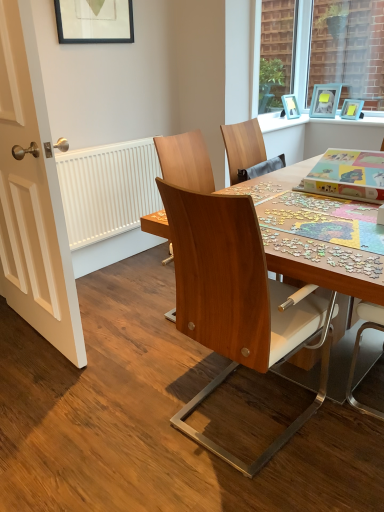
The image size is (384, 512). What are the coordinates of `wooden chair at center, acting as the 2th chair starting from the right` in the screenshot? It's located at (185, 161).

Locate an element on the screen. white painted wood door at left is located at coordinates (32, 195).

Which object is wider, white painted wood door at left or matte black picture frame at upper left, which is the third picture frame from right to left?

Wider between the two is white painted wood door at left.

Would you say white painted wood door at left is a long distance from matte black picture frame at upper left, which is the first picture frame from front to back?

Yes.

From the image's perspective, which is above, white painted wood door at left or matte black picture frame at upper left, positioned as the 1th picture frame in left-to-right order?

matte black picture frame at upper left, positioned as the 1th picture frame in left-to-right order, from the image's perspective.

Does white painted wood door at left have a smaller size compared to matte black picture frame at upper left, which is the first picture frame from front to back?

Incorrect, white painted wood door at left is not smaller in size than matte black picture frame at upper left, which is the first picture frame from front to back.

From the image's perspective, is wooden chair at center, which is the first chair in left-to-right order, above or below white painted wood door at left?

Clearly, from the image's perspective, wooden chair at center, which is the first chair in left-to-right order, is below white painted wood door at left.

Is the position of wooden chair at center, acting as the 2th chair starting from the right, less distant than that of white painted wood door at left?

No, it is behind white painted wood door at left.

Is white painted wood door at left completely or partially inside wooden chair at center, acting as the 2th chair starting from the right?

No.

Could you tell me if light blue plastic picture frame at upper right, the 1th picture frame viewed from the back, is facing wooden chair at center, which is the first chair in left-to-right order?

Yes, light blue plastic picture frame at upper right, the 1th picture frame viewed from the back, is aimed at wooden chair at center, which is the first chair in left-to-right order.

Between point (315, 89) and point (202, 175), which one is positioned in front?

The point (202, 175) is closer to the camera.

Does light blue plastic picture frame at upper right, marked as the 2th picture frame in a right-to-left arrangement, appear on the right side of wooden chair at center, which is the first chair in left-to-right order?

Yes.

Can you see light blue plastic picture frame at upper right, acting as the 2th picture frame starting from the left, touching wooden chair at center, acting as the 2th chair starting from the right?

No, light blue plastic picture frame at upper right, acting as the 2th picture frame starting from the left, is not next to wooden chair at center, acting as the 2th chair starting from the right.

Which is in front, matte blue picture frame at upper right, the 2th picture frame when ordered from back to front, or wooden chair at center, which is the first chair in left-to-right order?

wooden chair at center, which is the first chair in left-to-right order.

From the image's perspective, who appears lower, matte blue picture frame at upper right, the 2th picture frame when ordered from back to front, or wooden chair at center, acting as the 2th chair starting from the right?

wooden chair at center, acting as the 2th chair starting from the right, appears lower in the image.

Is matte blue picture frame at upper right, which ranks as the second picture frame in front-to-back order, oriented away from wooden chair at center, which is the first chair in left-to-right order?

No, matte blue picture frame at upper right, which ranks as the second picture frame in front-to-back order, is not facing away from wooden chair at center, which is the first chair in left-to-right order.

Which point is more forward, (353, 99) or (204, 160)?

The point (204, 160) is more forward.

How different are the orientations of wooden chair at center, which is the first chair in left-to-right order, and light blue plastic picture frame at upper right, marked as the 2th picture frame in a right-to-left arrangement, in degrees?

The angle between the facing direction of wooden chair at center, which is the first chair in left-to-right order, and the facing direction of light blue plastic picture frame at upper right, marked as the 2th picture frame in a right-to-left arrangement, is 79.7 degrees.

Between point (183, 156) and point (322, 112), which one is positioned behind?

The point (322, 112) is farther from the camera.

Is wooden chair at center, acting as the 2th chair starting from the right, facing towards light blue plastic picture frame at upper right, the 1th picture frame viewed from the back?

No, wooden chair at center, acting as the 2th chair starting from the right, does not turn towards light blue plastic picture frame at upper right, the 1th picture frame viewed from the back.

Can we say wooden chair at center, which is the first chair in left-to-right order, lies outside light blue plastic picture frame at upper right, the third picture frame viewed from the front?

Yes.

Starting from the white matte radiator at left, which picture frame is the 1st one to the right? Please provide its 2D coordinates.

[(325, 100)]

Considering the sizes of objects white matte radiator at left and light blue plastic picture frame at upper right, the third picture frame viewed from the front, in the image provided, who is shorter, white matte radiator at left or light blue plastic picture frame at upper right, the third picture frame viewed from the front,?

light blue plastic picture frame at upper right, the third picture frame viewed from the front, is shorter.

Considering the relative sizes of white matte radiator at left and light blue plastic picture frame at upper right, marked as the 2th picture frame in a right-to-left arrangement, in the image provided, is white matte radiator at left thinner than light blue plastic picture frame at upper right, marked as the 2th picture frame in a right-to-left arrangement,?

Indeed, white matte radiator at left has a lesser width compared to light blue plastic picture frame at upper right, marked as the 2th picture frame in a right-to-left arrangement.

Based on the photo, is light blue plastic picture frame at upper right, acting as the 2th picture frame starting from the left, at the back of white matte radiator at left?

No.

Considering the relative sizes of matte black picture frame at upper left, which is the first picture frame from front to back, and wooden chair at center, which appears as the 1th chair when viewed from the right, in the image provided, is matte black picture frame at upper left, which is the first picture frame from front to back, wider than wooden chair at center, which appears as the 1th chair when viewed from the right,?

No.

From the image's perspective, relative to wooden chair at center, the second chair when ordered from left to right, is matte black picture frame at upper left, which is the first picture frame from front to back, above or below?

From the image's perspective, matte black picture frame at upper left, which is the first picture frame from front to back, appears above wooden chair at center, the second chair when ordered from left to right.

There is a matte black picture frame at upper left, which is the first picture frame from front to back. In order to click on the 2nd chair below it (from the image's perspective) in this screenshot , I will do `click(235, 301)`.

In the image, there is a matte black picture frame at upper left, which is the 3th picture frame in back-to-front order. In order to click on door below it (from the image's perspective) in this screenshot , I will do `click(32, 195)`.

Where is `door in front of the wooden chair at center, which is the first chair in left-to-right order`? This screenshot has width=384, height=512. door in front of the wooden chair at center, which is the first chair in left-to-right order is located at coordinates (32, 195).

Looking at the image, which one is located closer to matte black picture frame at upper left, which is the first picture frame from front to back, wooden chair at center, acting as the 2th chair starting from the right, or light blue plastic picture frame at upper right, marked as the 2th picture frame in a right-to-left arrangement?

wooden chair at center, acting as the 2th chair starting from the right, is closer to matte black picture frame at upper left, which is the first picture frame from front to back.

Which object lies further to the anchor point light blue plastic picture frame at upper right, the third picture frame viewed from the front, matte black picture frame at upper left, which is the third picture frame from right to left, or wooden chair at center, which is the first chair in left-to-right order?

Based on the image, matte black picture frame at upper left, which is the third picture frame from right to left, appears to be further to light blue plastic picture frame at upper right, the third picture frame viewed from the front.

When comparing their distances from light blue plastic picture frame at upper right, acting as the 2th picture frame starting from the left, does wooden chair at center, acting as the 2th chair starting from the right, or white painted wood door at left seem closer?

wooden chair at center, acting as the 2th chair starting from the right, lies closer to light blue plastic picture frame at upper right, acting as the 2th picture frame starting from the left, than the other object.

Looking at the image, which one is located closer to white matte radiator at left, matte black picture frame at upper left, which is the 3th picture frame in back-to-front order, or white painted wood door at left?

Among the two, white painted wood door at left is located nearer to white matte radiator at left.

Considering their positions, is light blue plastic picture frame at upper right, the 1th picture frame viewed from the back, positioned closer to matte black picture frame at upper left, which is the third picture frame from right to left, than white painted wood door at left?

white painted wood door at left.

Based on the photo, looking at the image, which one is located further to wooden chair at center, which appears as the 1th chair when viewed from the right, wooden chair at center, acting as the 2th chair starting from the right, or matte blue picture frame at upper right, the 2th picture frame when ordered from back to front?

Among the two, matte blue picture frame at upper right, the 2th picture frame when ordered from back to front, is located further to wooden chair at center, which appears as the 1th chair when viewed from the right.

Looking at the image, which one is located closer to white painted wood door at left, matte black picture frame at upper left, which is the third picture frame from right to left, or wooden chair at center, which is the first chair in left-to-right order?

wooden chair at center, which is the first chair in left-to-right order.

From the image, which object appears to be nearer to white painted wood door at left, wooden chair at center, which appears as the 1th chair when viewed from the right, or light blue plastic picture frame at upper right, marked as the 2th picture frame in a right-to-left arrangement?

wooden chair at center, which appears as the 1th chair when viewed from the right, is positioned closer to the anchor white painted wood door at left.

Find the location of a particular element. The image size is (384, 512). radiator situated between matte black picture frame at upper left, which is the first picture frame from front to back, and matte blue picture frame at upper right, which ranks as the third picture frame in left-to-right order, from left to right is located at coordinates (108, 189).

Locate an element on the screen. radiator between matte black picture frame at upper left, positioned as the 1th picture frame in left-to-right order, and wooden chair at center, which is the first chair in left-to-right order, vertically is located at coordinates (108, 189).

Identify the location of radiator situated between white painted wood door at left and matte blue picture frame at upper right, which ranks as the second picture frame in front-to-back order, from left to right. The height and width of the screenshot is (512, 384). (108, 189).

At what (x,y) coordinates should I click in order to perform the action: click on chair between wooden chair at center, which appears as the 1th chair when viewed from the right, and matte blue picture frame at upper right, the 2th picture frame when ordered from back to front, from front to back. Please return your answer as a coordinate pair (x, y). This screenshot has height=512, width=384. Looking at the image, I should click on (185, 161).